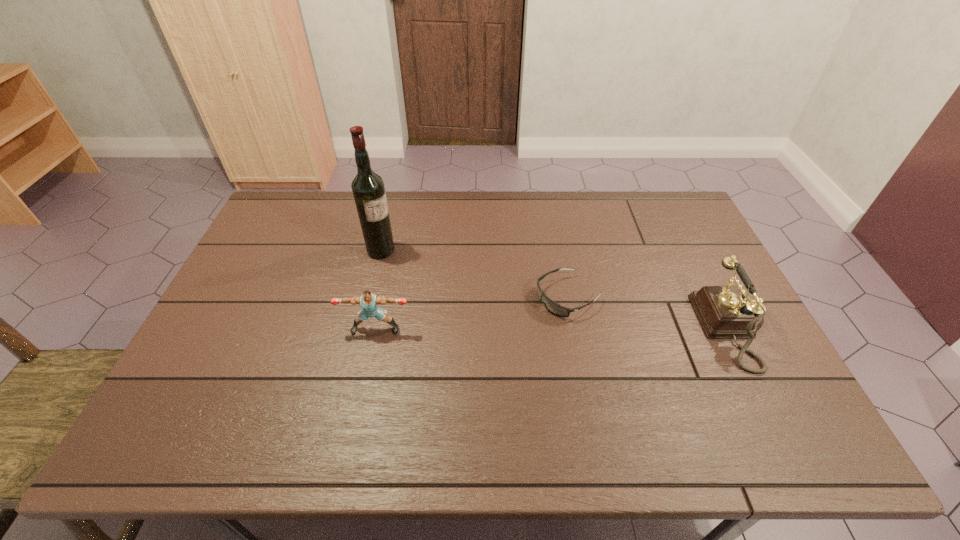
This screenshot has width=960, height=540. In order to click on puncher in this screenshot , I will do `click(369, 302)`.

Find the location of a particular element. telephone is located at coordinates (725, 312).

The height and width of the screenshot is (540, 960). In order to click on the tallest object in this screenshot , I will do `click(368, 189)`.

The width and height of the screenshot is (960, 540). What are the coordinates of `the farthest object` in the screenshot? It's located at [x=368, y=189].

You are a GUI agent. You are given a task and a screenshot of the screen. Output one action in this format:
    pyautogui.click(x=<x>, y=<y>)
    Task: Click on the shortest object
    Image resolution: width=960 pixels, height=540 pixels.
    Given the screenshot: What is the action you would take?
    (553, 307)

This screenshot has height=540, width=960. In order to click on goggles in this screenshot , I will do `click(553, 307)`.

Image resolution: width=960 pixels, height=540 pixels. Find the location of `free location located 0.190m on the front-facing side of the puncher`. free location located 0.190m on the front-facing side of the puncher is located at coordinates (361, 399).

Where is `vacant area situated 0.320m on the front and back of the tallest object`? This screenshot has width=960, height=540. vacant area situated 0.320m on the front and back of the tallest object is located at coordinates (473, 298).

Locate an element on the screen. vacant space situated 0.230m on the front and back of the tallest object is located at coordinates (448, 285).

Where is `vacant space situated on the front and back of the tallest object`? The width and height of the screenshot is (960, 540). vacant space situated on the front and back of the tallest object is located at coordinates (488, 305).